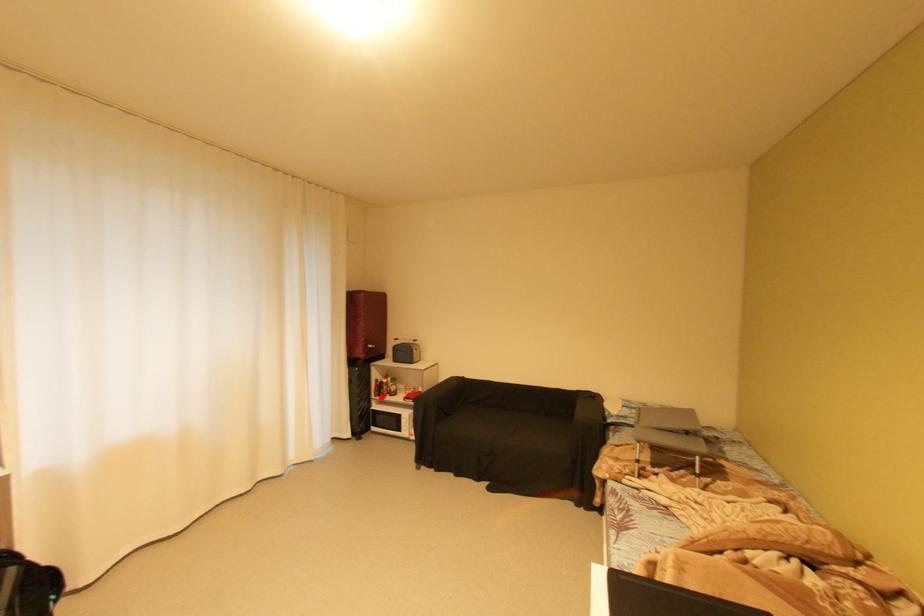
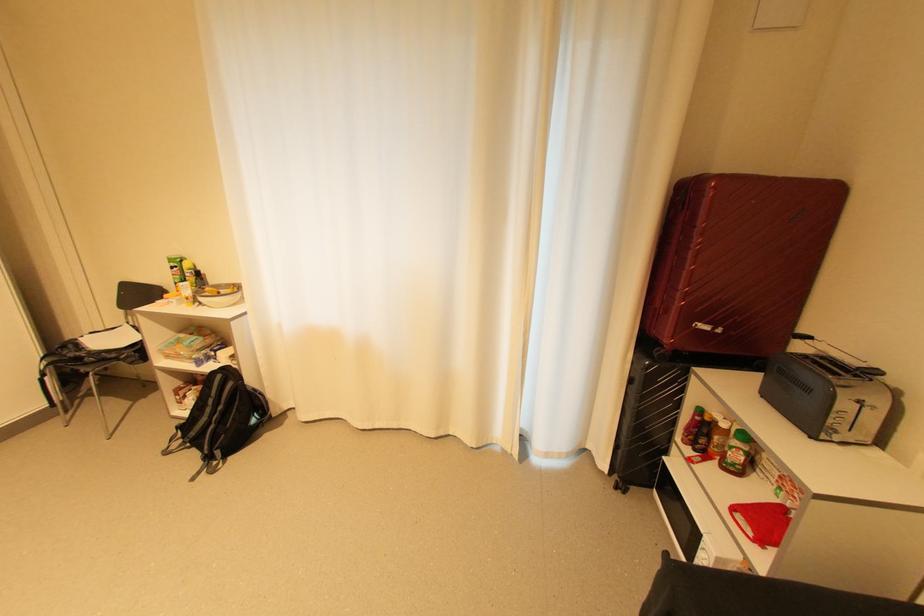
Question: I am providing you with two images of the same scene from different viewpoints. Given a red point in image1, look at the same physical point in image2. Is it:

Choices:
 (A) Closer to the viewpoint
 (B) Farther from the viewpoint

Answer: (A)